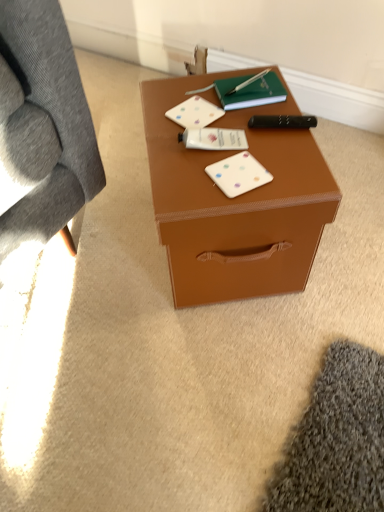
Locate an element on the screen. The image size is (384, 512). vacant location behind white matte card game at center, which is the 1th card game in bottom-to-top order is located at coordinates pyautogui.click(x=233, y=128).